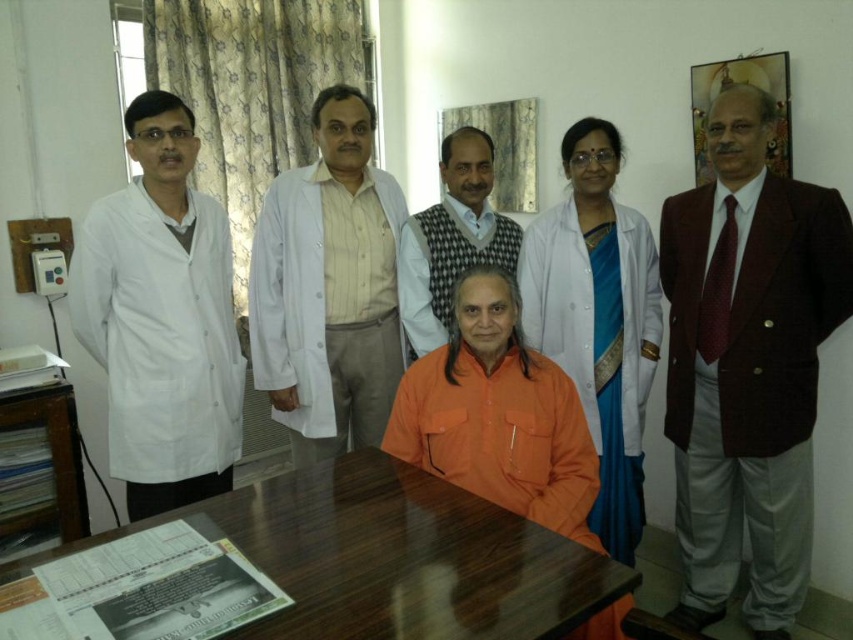
You are a person who needs to place a heavy book on the surface of the brown glossy table at center. Considering the height of the table and the lab coat, will the white glossy lab coat at center interfere with placing the book?

The brown glossy table at center has a lesser height compared to white glossy lab coat at center, so the white glossy lab coat at center may interfere with placing the heavy book on the table because the coat is taller than the table.

You are a visitor entering the room and need to locate the maroon fabric suit at right and the white glossy lab coat at center. From your perspective, which object is positioned lower?

The maroon fabric suit at right is located below the white glossy lab coat at center, so the maroon fabric suit at right is positioned lower.

You are organizing a meeting in this room and need to place a large folder on the surface that can accommodate it. Which object between the brown glossy table at center and the white glossy lab coat at center would be suitable for placing the folder?

The brown glossy table at center is larger in size than the white glossy lab coat at center, so the folder should be placed on the brown glossy table at center as it has enough space.